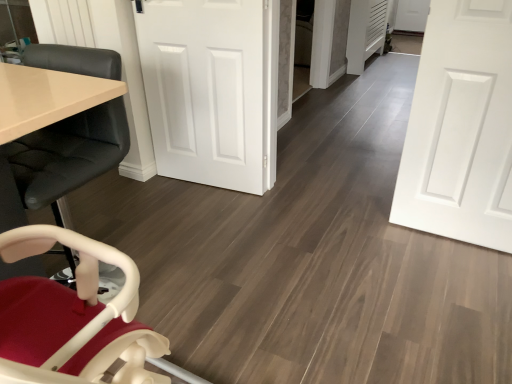
Question: Which direction should I rotate to look at white smooth door at center, marked as the 2th door in a right-to-left arrangement, — up or down?

Choices:
 (A) up
 (B) down

Answer: (A)

Question: Would you consider white matte door at center, placed as the second door when sorted from left to right, to be distant from matte black chair at left?

Choices:
 (A) no
 (B) yes

Answer: (B)

Question: Is white matte door at center, placed as the second door when sorted from left to right, wider than matte black chair at left?

Choices:
 (A) no
 (B) yes

Answer: (A)

Question: From the image's perspective, does white matte door at center, placed as the second door when sorted from left to right, appear higher than matte black chair at left?

Choices:
 (A) yes
 (B) no

Answer: (A)

Question: Is the depth of white matte door at center, which is the first door in right-to-left order, less than that of matte black chair at left?

Choices:
 (A) yes
 (B) no

Answer: (B)

Question: Does white matte door at center, placed as the second door when sorted from left to right, have a smaller size compared to matte black chair at left?

Choices:
 (A) no
 (B) yes

Answer: (B)

Question: Does white matte door at center, placed as the second door when sorted from left to right, appear on the left side of matte black chair at left?

Choices:
 (A) yes
 (B) no

Answer: (B)

Question: Is white smooth door at center, acting as the first door starting from the left, shorter than white matte door at center, which is the first door in right-to-left order?

Choices:
 (A) no
 (B) yes

Answer: (B)

Question: Does white smooth door at center, marked as the 2th door in a right-to-left arrangement, come in front of white matte door at center, which is the first door in right-to-left order?

Choices:
 (A) no
 (B) yes

Answer: (A)

Question: Can you confirm if white smooth door at center, acting as the first door starting from the left, is thinner than white matte door at center, placed as the second door when sorted from left to right?

Choices:
 (A) yes
 (B) no

Answer: (B)

Question: Is white smooth door at center, acting as the first door starting from the left, placed right next to white matte door at center, placed as the second door when sorted from left to right?

Choices:
 (A) no
 (B) yes

Answer: (A)

Question: Considering the relative positions of white smooth door at center, marked as the 2th door in a right-to-left arrangement, and white matte door at center, which is the first door in right-to-left order, in the image provided, is white smooth door at center, marked as the 2th door in a right-to-left arrangement, to the right of white matte door at center, which is the first door in right-to-left order, from the viewer's perspective?

Choices:
 (A) yes
 (B) no

Answer: (B)

Question: Does white smooth door at center, acting as the first door starting from the left, turn towards white matte door at center, which is the first door in right-to-left order?

Choices:
 (A) no
 (B) yes

Answer: (A)

Question: Are matte black chair at left and white smooth door at center, acting as the first door starting from the left, far apart?

Choices:
 (A) yes
 (B) no

Answer: (B)